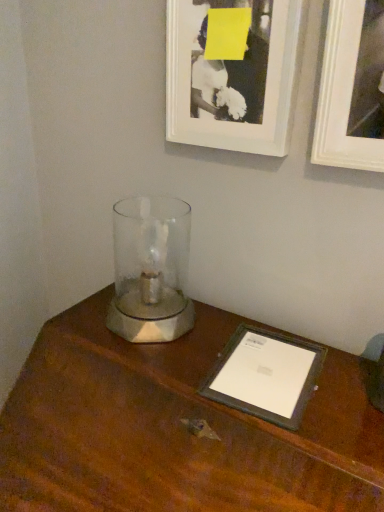
Question: From the image's perspective, is black matte picture frame at upper center, placed as the 2th picture frame when sorted from right to left, positioned above or below brown wood table at center?

Choices:
 (A) below
 (B) above

Answer: (B)

Question: Is point (278, 116) closer or farther from the camera than point (13, 425)?

Choices:
 (A) farther
 (B) closer

Answer: (B)

Question: Based on their relative distances, which object is farther from the black matte picture frame at upper center, placed as the 2th picture frame when sorted from right to left?

Choices:
 (A) white matte picture frame at upper right, the 1th picture frame in the right-to-left sequence
 (B) brown wood table at center

Answer: (B)

Question: Which object is the farthest from the brown wood table at center?

Choices:
 (A) white matte picture frame at upper right, the 1th picture frame in the right-to-left sequence
 (B) black matte picture frame at upper center, the 1th picture frame viewed from the left

Answer: (A)